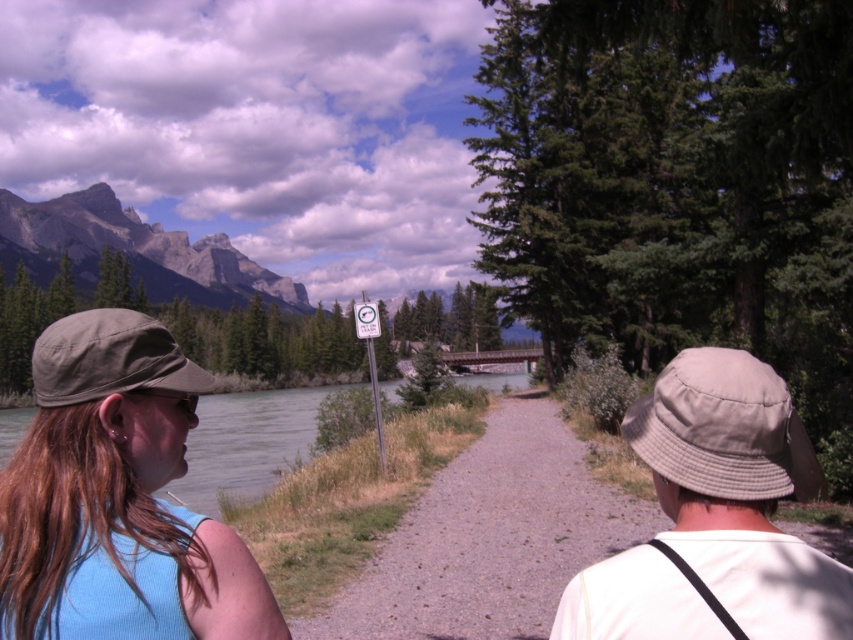
Does gravel path at center appear on the left side of rocky gray mountain at upper left?

Incorrect, gravel path at center is not on the left side of rocky gray mountain at upper left.

Between point (537, 544) and point (184, 252), which one is positioned behind?

The point (184, 252) is more distant.

What are the coordinates of `gravel path at center` in the screenshot? It's located at (490, 538).

Is light beige fabric bucket hat at center-right to the left of rocky gray mountain at upper left from the viewer's perspective?

Incorrect, light beige fabric bucket hat at center-right is not on the left side of rocky gray mountain at upper left.

Does light beige fabric bucket hat at center-right have a larger size compared to rocky gray mountain at upper left?

Incorrect, light beige fabric bucket hat at center-right is not larger than rocky gray mountain at upper left.

Which is in front, point (764, 554) or point (218, 300)?

Point (764, 554) is in front.

Where is `light beige fabric bucket hat at center-right`? The height and width of the screenshot is (640, 853). light beige fabric bucket hat at center-right is located at coordinates (737, 492).

In the scene shown: Can you confirm if tan fabric bucket hat at upper right is taller than green fabric baseball cap at left?

No.

Consider the image. Is tan fabric bucket hat at upper right bigger than green fabric baseball cap at left?

No, tan fabric bucket hat at upper right is not bigger than green fabric baseball cap at left.

Between point (705, 420) and point (194, 385), which one is positioned in front?

Point (705, 420) is in front.

Locate an element on the screen. tan fabric bucket hat at upper right is located at coordinates (724, 428).